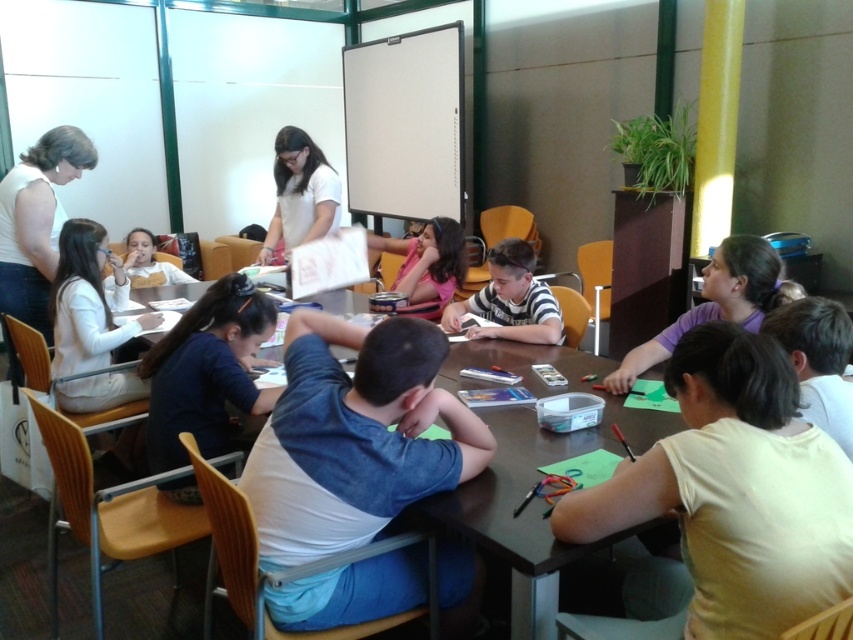
Question: Which object is the closest to the blue denim shirt at center?

Choices:
 (A) white sleeveless top at upper left
 (B) brown wooden table at center

Answer: (B)

Question: Does blue denim shirt at center have a lesser width compared to brown wooden table at center?

Choices:
 (A) no
 (B) yes

Answer: (A)

Question: Among these objects, which one is nearest to the camera?

Choices:
 (A) blue denim shirt at center
 (B) white sleeveless top at upper left
 (C) brown wooden table at center

Answer: (A)

Question: Does blue denim shirt at center come in front of brown wooden table at center?

Choices:
 (A) yes
 (B) no

Answer: (A)

Question: Which point is farther to the camera?

Choices:
 (A) white sleeveless top at upper left
 (B) brown wooden table at center
 (C) blue denim shirt at center

Answer: (A)

Question: Does blue denim shirt at center appear over white sleeveless top at upper left?

Choices:
 (A) yes
 (B) no

Answer: (B)